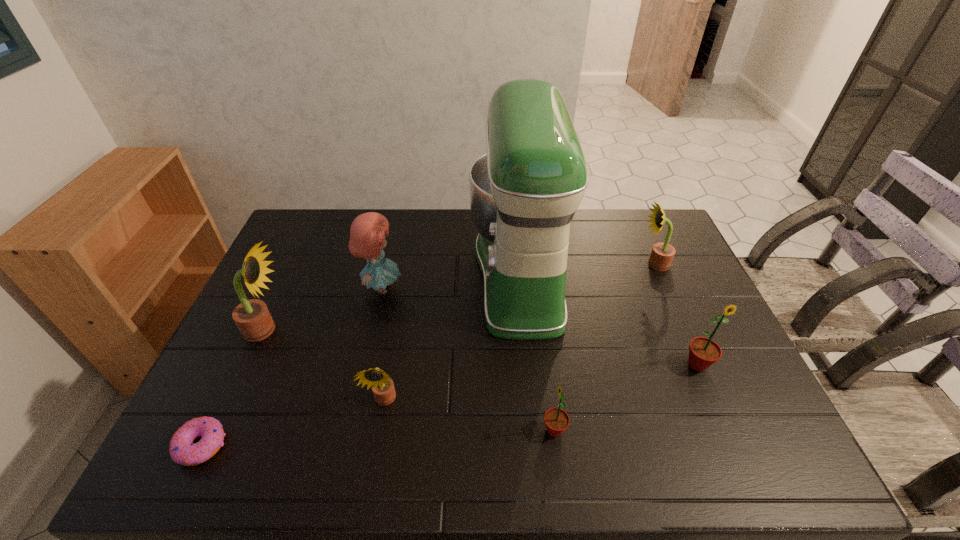
Where is `the nearer green sunflower`? The image size is (960, 540). the nearer green sunflower is located at coordinates (556, 420).

Find the location of a particular element. the smallest yellow sunflower is located at coordinates (383, 389).

The image size is (960, 540). What are the coordinates of `the second yellow sunflower from right to left` in the screenshot? It's located at (383, 389).

This screenshot has height=540, width=960. Identify the location of the shortest object. (183, 451).

You are a GUI agent. You are given a task and a screenshot of the screen. Output one action in this format:
    pyautogui.click(x=<x>, y=<y>)
    Task: Click on the pink doughnut
    Image resolution: width=960 pixels, height=540 pixels.
    Given the screenshot: What is the action you would take?
    pyautogui.click(x=183, y=451)

The width and height of the screenshot is (960, 540). Find the location of `vacant space situated on the controls of the mixer`. vacant space situated on the controls of the mixer is located at coordinates point(394,274).

Where is `free spot located on the controls of the mixer`? free spot located on the controls of the mixer is located at coordinates (445, 274).

You are a GUI agent. You are given a task and a screenshot of the screen. Output one action in this format:
    pyautogui.click(x=<x>, y=<y>)
    Task: Click on the vacant region located 0.080m on the controls of the mixer
    
    Given the screenshot: What is the action you would take?
    pos(445,274)

I want to click on free space located on the face of the biggest yellow sunflower, so 333,330.

The width and height of the screenshot is (960, 540). Find the location of `blank space located on the front-facing side of the doll`. blank space located on the front-facing side of the doll is located at coordinates (x=479, y=288).